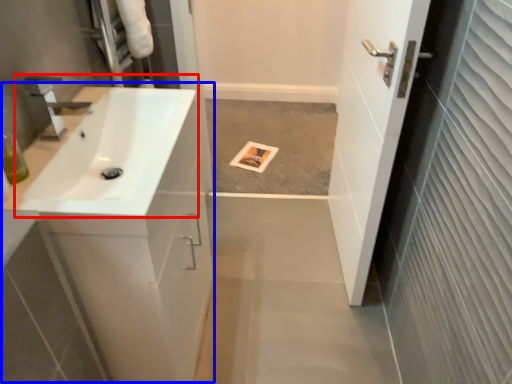
Question: Which point is closer to the camera, sink (highlighted by a red box) or counter top (highlighted by a blue box)?

Choices:
 (A) sink
 (B) counter top

Answer: (A)